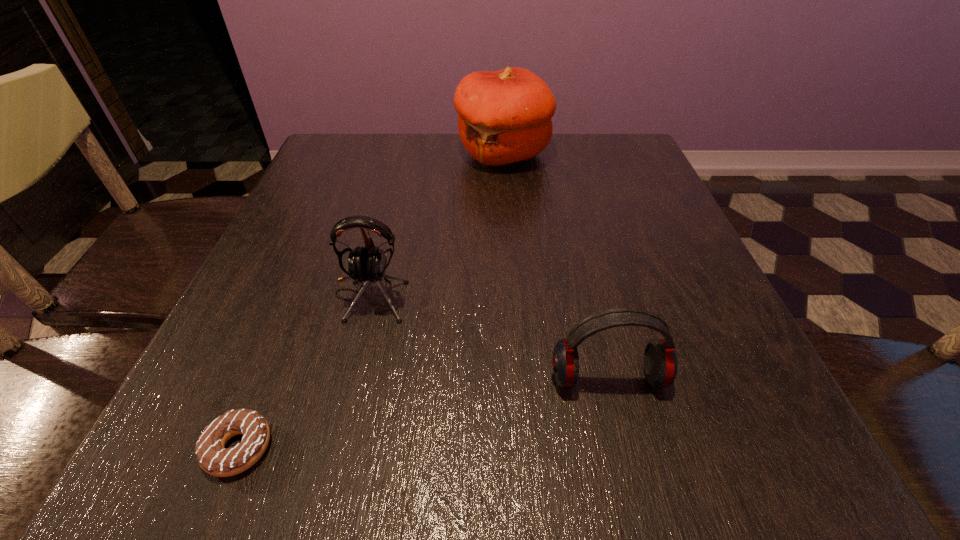
The width and height of the screenshot is (960, 540). In order to click on vacant area that lies between the third object from right to left and the shortest object in this screenshot , I will do `click(304, 372)`.

The image size is (960, 540). Identify the location of free point between the right earphone and the second farthest object. (489, 336).

You are a GUI agent. You are given a task and a screenshot of the screen. Output one action in this format:
    pyautogui.click(x=<x>, y=<y>)
    Task: Click on the vacant area that lies between the shorter earphone and the nearest object
    The width and height of the screenshot is (960, 540).
    Given the screenshot: What is the action you would take?
    pyautogui.click(x=423, y=413)

Identify the location of free spot between the third object from right to left and the tallest object. (436, 225).

The width and height of the screenshot is (960, 540). I want to click on object that can be found as the second closest to the shortest object, so click(x=660, y=362).

Find the location of a particular element. object that is the third closest to the farther earphone is located at coordinates (504, 117).

Find the location of `vacant area that satisfies the following two spatial constraints: 1. on the back side of the pumpkin; 2. on the right side of the nearest object`. vacant area that satisfies the following two spatial constraints: 1. on the back side of the pumpkin; 2. on the right side of the nearest object is located at coordinates (357, 154).

Identify the location of vacant region that satisfies the following two spatial constraints: 1. on the back side of the left earphone; 2. on the left side of the shortest object. (300, 295).